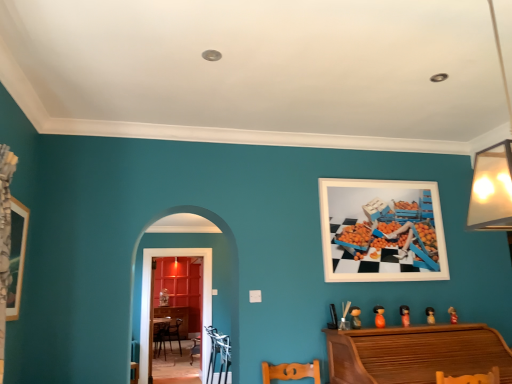
Question: Is metallic silver armchair at lower center placed right next to wooden piano at lower right?

Choices:
 (A) no
 (B) yes

Answer: (A)

Question: Considering the relative sizes of metallic silver armchair at lower center and wooden piano at lower right in the image provided, is metallic silver armchair at lower center shorter than wooden piano at lower right?

Choices:
 (A) no
 (B) yes

Answer: (A)

Question: Can you confirm if metallic silver armchair at lower center is thinner than wooden piano at lower right?

Choices:
 (A) no
 (B) yes

Answer: (B)

Question: Is wooden piano at lower right a part of metallic silver armchair at lower center?

Choices:
 (A) yes
 (B) no

Answer: (B)

Question: Could you tell me if metallic silver armchair at lower center is turned towards wooden piano at lower right?

Choices:
 (A) yes
 (B) no

Answer: (B)

Question: From the image's perspective, would you say metallic silver armchair at lower center is positioned over wooden piano at lower right?

Choices:
 (A) yes
 (B) no

Answer: (B)

Question: Is matte orange figurine at lower right, the 1th toy viewed from the right, completely or partially outside of orange matte toy at lower right, the 2th toy viewed from the left?

Choices:
 (A) yes
 (B) no

Answer: (A)

Question: Can you confirm if matte orange figurine at lower right, the 1th toy viewed from the right, is shorter than orange matte toy at lower right, which is the 4th toy from right to left?

Choices:
 (A) yes
 (B) no

Answer: (A)

Question: Is matte orange figurine at lower right, the 5th toy when ordered from left to right, positioned with its back to orange matte toy at lower right, which is the 4th toy from right to left?

Choices:
 (A) no
 (B) yes

Answer: (A)

Question: Can you confirm if matte orange figurine at lower right, the 5th toy when ordered from left to right, is thinner than orange matte toy at lower right, which is the 4th toy from right to left?

Choices:
 (A) yes
 (B) no

Answer: (A)

Question: From the image's perspective, would you say matte orange figurine at lower right, the 5th toy when ordered from left to right, is shown under orange matte toy at lower right, which is the 4th toy from right to left?

Choices:
 (A) no
 (B) yes

Answer: (B)

Question: From a real-world perspective, is matte orange figurine at lower right, the 5th toy when ordered from left to right, beneath orange matte toy at lower right, which is the 4th toy from right to left?

Choices:
 (A) yes
 (B) no

Answer: (A)

Question: Is wooden dresser at center positioned with its back to metallic silver armchair at lower center?

Choices:
 (A) yes
 (B) no

Answer: (B)